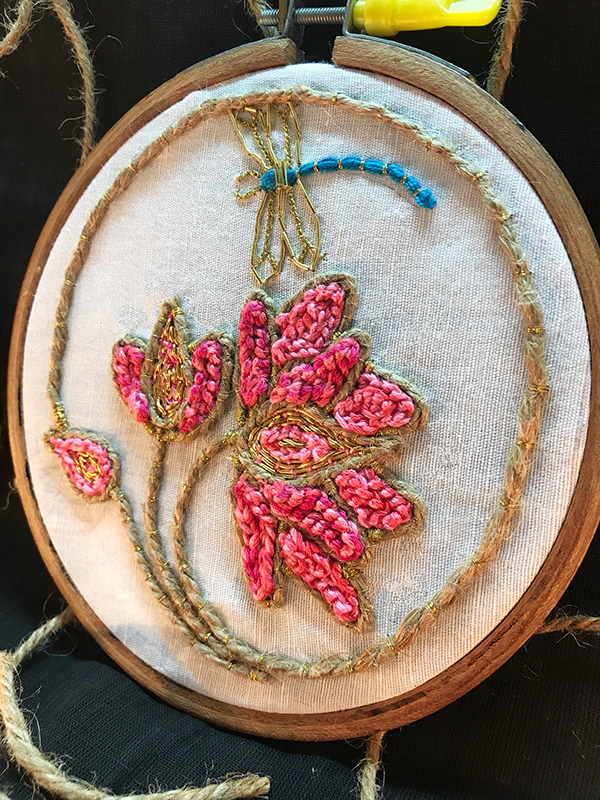
Image resolution: width=600 pixels, height=800 pixels. Find the location of `white cloth`. white cloth is located at coordinates (474, 406).